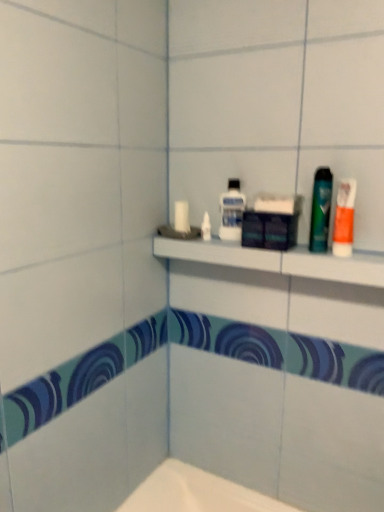
Question: Would you say green glossy mouthwash at right, which is counted as the first mouthwash, starting from the front, is to the left or to the right of clear plastic mouthwash at upper center, which is the second mouthwash in front-to-back order, in the picture?

Choices:
 (A) left
 (B) right

Answer: (B)

Question: From the image's perspective, relative to clear plastic mouthwash at upper center, positioned as the first mouthwash in left-to-right order, is green glossy mouthwash at right, acting as the second mouthwash starting from the left, above or below?

Choices:
 (A) below
 (B) above

Answer: (A)

Question: Which is farther from the white plastic shelf at upper center?

Choices:
 (A) orange matte toothpaste at right
 (B) green glossy mouthwash at right, acting as the second mouthwash starting from the left
 (C) clear plastic mouthwash at upper center, positioned as the second mouthwash in right-to-left order

Answer: (A)

Question: Which object is positioned closest to the white plastic shelf at upper center?

Choices:
 (A) clear plastic mouthwash at upper center, positioned as the second mouthwash in right-to-left order
 (B) green glossy mouthwash at right, which ranks as the 1th mouthwash in right-to-left order
 (C) orange matte toothpaste at right

Answer: (A)